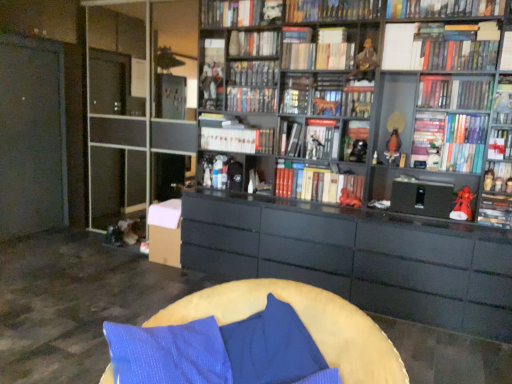
This screenshot has width=512, height=384. What are the coordinates of `empty space that is ontop of hardcover book at center, arranged as the 5th book when viewed from the top (from a real-world perspective)` in the screenshot? It's located at (321, 42).